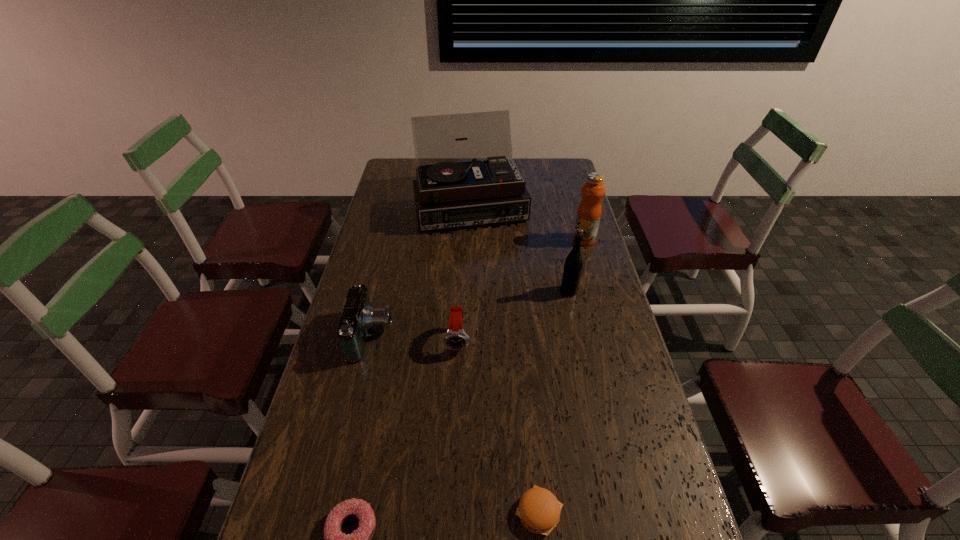
In order to click on free spot that satisfies the following two spatial constraints: 1. on the face of the patty; 2. on the right side of the watch in this screenshot , I will do `click(450, 512)`.

Locate an element on the screen. The width and height of the screenshot is (960, 540). free location that satisfies the following two spatial constraints: 1. on the back side of the patty; 2. on the front-facing side of the camcorder is located at coordinates (522, 335).